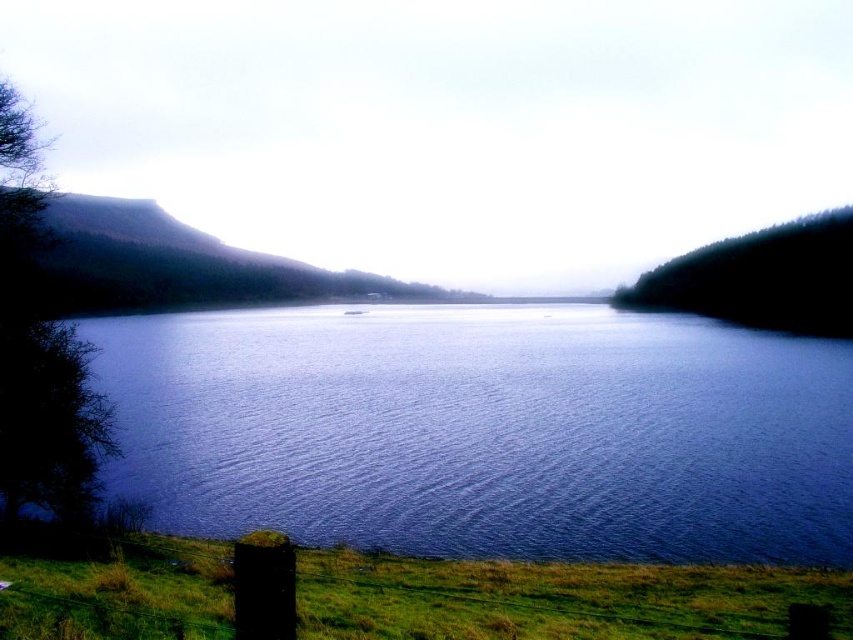
Is blue water at center further to the viewer compared to green grassy at lower left?

Yes, it is behind green grassy at lower left.

Does blue water at center appear over green grassy at lower left?

Correct, blue water at center is located above green grassy at lower left.

Locate an element on the screen. The width and height of the screenshot is (853, 640). blue water at center is located at coordinates (485, 429).